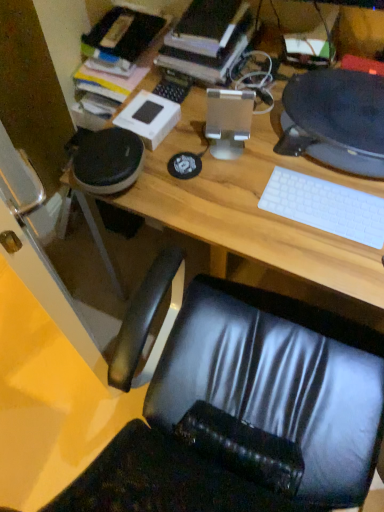
Find the location of `blank space to the left of white matte keyboard at right`. blank space to the left of white matte keyboard at right is located at coordinates (243, 207).